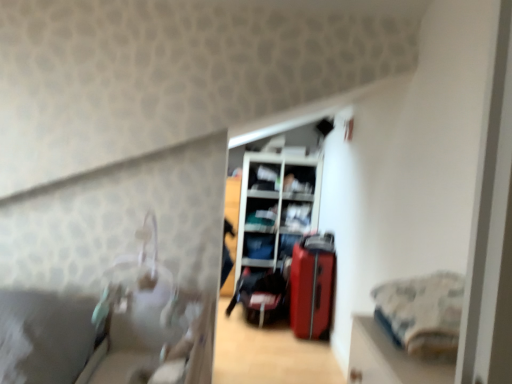
Question: Is metallic silver shelf at center, which is the second shelf in bottom-to-top order, turned away from shiny red suitcase at center, arranged as the 1th luggage when viewed from the right?

Choices:
 (A) yes
 (B) no

Answer: (B)

Question: Does metallic silver shelf at center, which is the second shelf in bottom-to-top order, have a greater width compared to shiny red suitcase at center, positioned as the 2th luggage in left-to-right order?

Choices:
 (A) yes
 (B) no

Answer: (B)

Question: Considering the relative positions of metallic silver shelf at center, which is the second shelf in bottom-to-top order, and shiny red suitcase at center, positioned as the 2th luggage in left-to-right order, in the image provided, is metallic silver shelf at center, which is the second shelf in bottom-to-top order, to the left of shiny red suitcase at center, positioned as the 2th luggage in left-to-right order, from the viewer's perspective?

Choices:
 (A) yes
 (B) no

Answer: (A)

Question: Is metallic silver shelf at center, which is the second shelf in bottom-to-top order, at the right side of shiny red suitcase at center, arranged as the 1th luggage when viewed from the right?

Choices:
 (A) yes
 (B) no

Answer: (B)

Question: Does metallic silver shelf at center, which is the second shelf in bottom-to-top order, come in front of shiny red suitcase at center, positioned as the 2th luggage in left-to-right order?

Choices:
 (A) no
 (B) yes

Answer: (A)

Question: Can you confirm if metallic silver shelf at center, the 4th shelf from the top, is shorter than shiny red suitcase at center, arranged as the 1th luggage when viewed from the right?

Choices:
 (A) yes
 (B) no

Answer: (A)

Question: Is matte white shelf at center, the fifth shelf ordered from the bottom, located within matte black suitcase at center, which is counted as the 1th luggage, starting from the left?

Choices:
 (A) no
 (B) yes

Answer: (A)

Question: Is matte black suitcase at center, the second luggage in the right-to-left sequence, not within matte white shelf at center, the fifth shelf ordered from the bottom?

Choices:
 (A) yes
 (B) no

Answer: (A)

Question: Is matte black suitcase at center, which is counted as the 1th luggage, starting from the left, behind matte white shelf at center, which is counted as the 1th shelf, starting from the top?

Choices:
 (A) yes
 (B) no

Answer: (B)

Question: Can you confirm if matte black suitcase at center, the second luggage in the right-to-left sequence, is smaller than matte white shelf at center, the fifth shelf ordered from the bottom?

Choices:
 (A) no
 (B) yes

Answer: (A)

Question: Is matte black suitcase at center, the second luggage in the right-to-left sequence, at the right side of matte white shelf at center, the fifth shelf ordered from the bottom?

Choices:
 (A) yes
 (B) no

Answer: (B)

Question: Is matte black suitcase at center, which is counted as the 1th luggage, starting from the left, beside matte white shelf at center, the fifth shelf ordered from the bottom?

Choices:
 (A) yes
 (B) no

Answer: (B)

Question: Is matte white shelf at center, marked as the 3th shelf in a top-to-bottom arrangement, facing away from matte white shelf at upper center, which is the 2th shelf in top-to-bottom order?

Choices:
 (A) yes
 (B) no

Answer: (B)